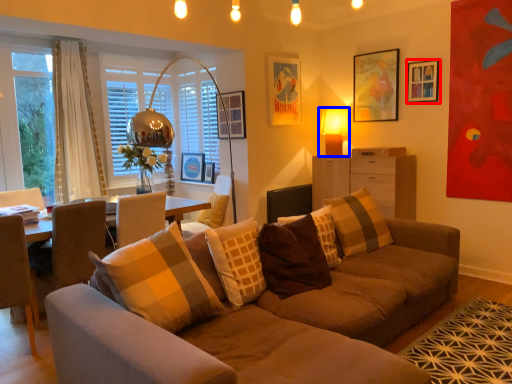
Question: Which point is further to the camera, picture frame (highlighted by a red box) or table lamp (highlighted by a blue box)?

Choices:
 (A) picture frame
 (B) table lamp

Answer: (B)